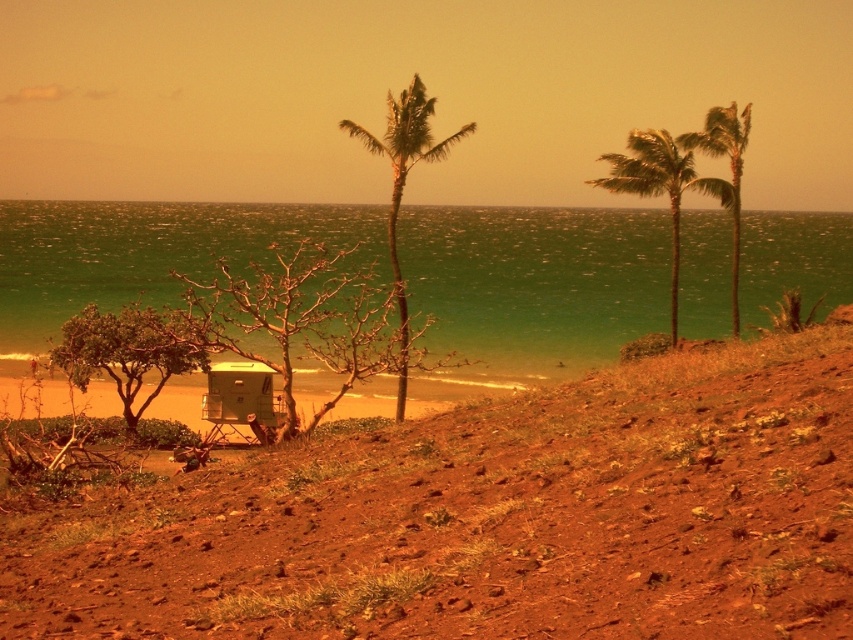
Question: Which object is closer to the camera taking this photo?

Choices:
 (A) green leafy tree at lower left
 (B) dirt/soil hillside at lower left

Answer: (B)

Question: Which object is the farthest from the green leafy palm tree at center?

Choices:
 (A) green leafy palm tree at upper right
 (B) green leafy palm trees at right

Answer: (B)

Question: Does green leafy palm tree at center appear over green leafy palm tree at upper right?

Choices:
 (A) no
 (B) yes

Answer: (B)

Question: Does dirt/soil hillside at lower left lie behind green water at center?

Choices:
 (A) yes
 (B) no

Answer: (B)

Question: Which point is farther to the camera?

Choices:
 (A) green water at center
 (B) green leafy tree at lower left
 (C) dirt/soil hillside at lower left

Answer: (A)

Question: Is green leafy palm tree at upper right positioned at the back of green leafy palm trees at right?

Choices:
 (A) no
 (B) yes

Answer: (A)